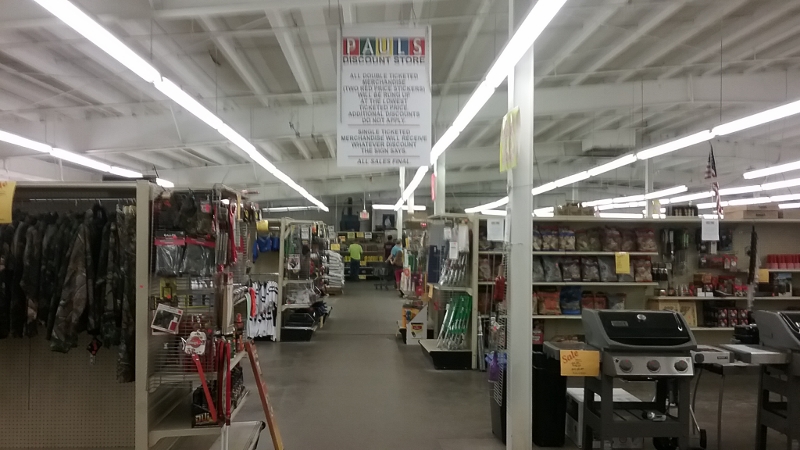
At what (x,y) coordinates should I click in order to perform the action: click on knob. Please return your answer as a coordinate pair (x, y). The width and height of the screenshot is (800, 450). Looking at the image, I should click on (649, 367), (678, 366), (626, 368).